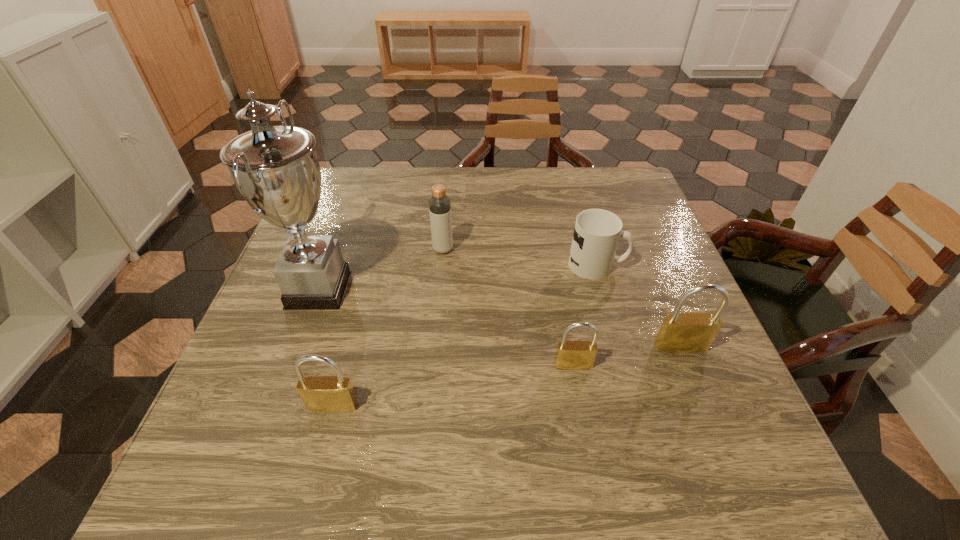
Please point a location where one more padlock can be added evenly. Please provide its 2D coordinates. Your answer should be formatted as a tuple, i.e. [(x, y)], where the tuple contains the x and y coordinates of a point satisfying the conditions above.

[(458, 384)]